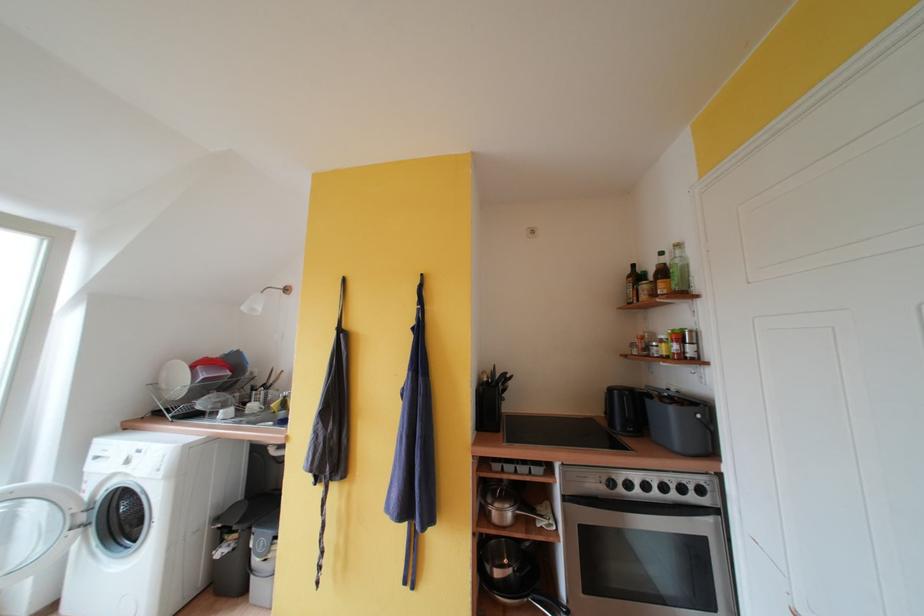
The height and width of the screenshot is (616, 924). I want to click on black electric kettle, so pyautogui.click(x=505, y=504).